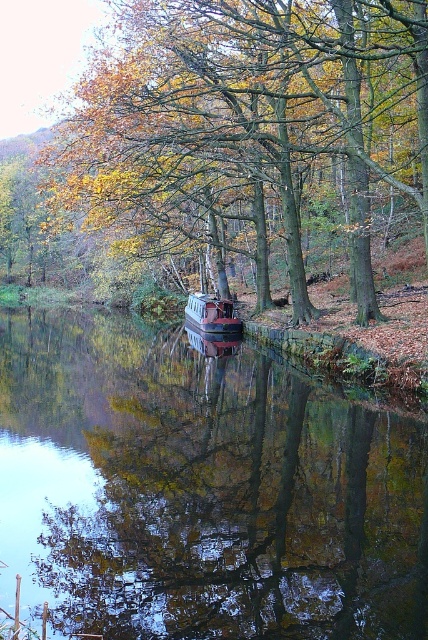
You are standing on the riverbank and want to take a photo of both the golden wood tree at center and the matte red boat at center. Which object will appear taller in your photo?

The golden wood tree at center will appear taller in the photo since it has a greater height compared to the matte red boat at center.

You are standing on the riverbank and see the smooth reflective water at center and the golden wood tree at center. Which object is closer to the ground?

The smooth reflective water at center is below golden wood tree at center, so it is closer to the ground.

Looking at this image, you are standing at the edge of the river and see two points in the water. The first point is at coordinate point (324, 113) and the second is at point (189, 296). Which point is nearer to you?

Point (324, 113) is closer to the viewer than point (189, 296).